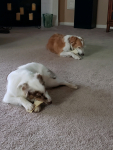
Locate an element on the screen. The width and height of the screenshot is (113, 150). tan wall is located at coordinates (68, 13), (102, 11).